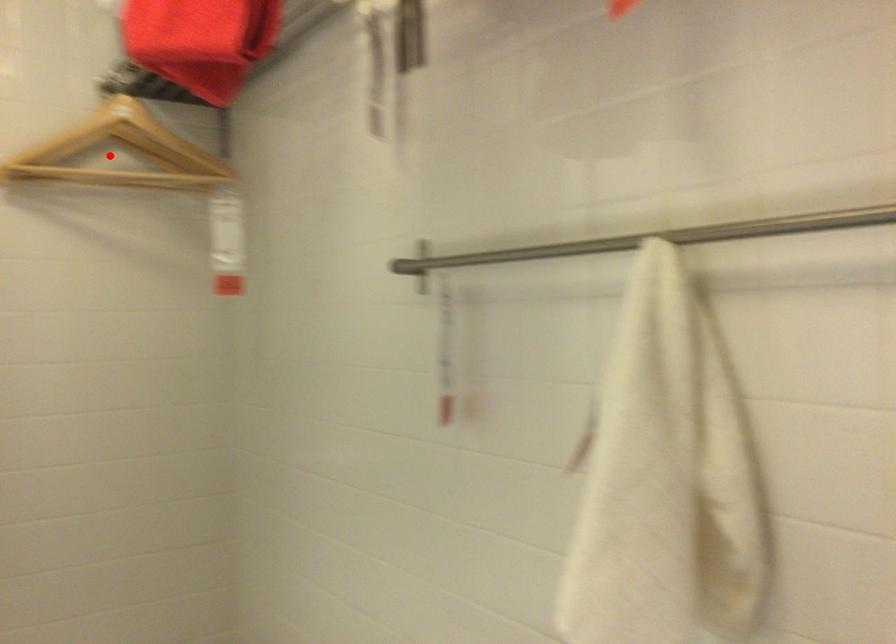
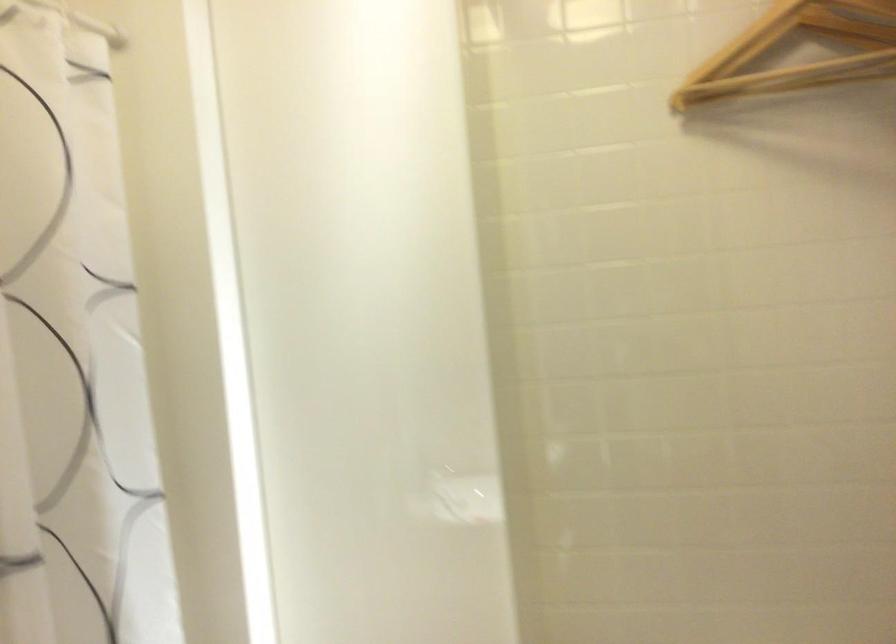
Question: I am providing you with two images of the same scene from different viewpoints. Image1 has a red point marked. In image2, the corresponding 3D location appears at what relative position? Reply with the corresponding letter.

Choices:
 (A) Closer
 (B) Farther

Answer: (A)